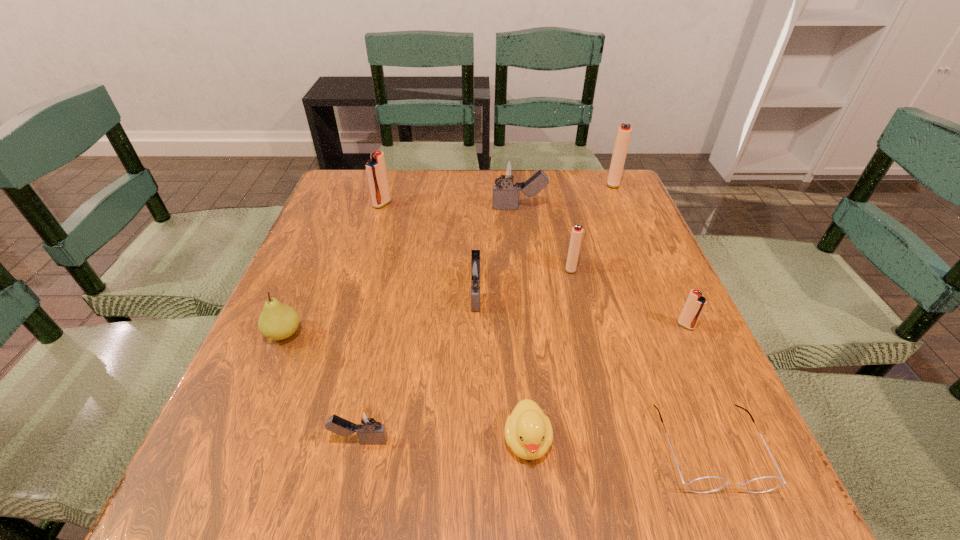
Point out which gray igniter is positioned as the second nearest to the third object from left to right. Please provide its 2D coordinates. Your answer should be formatted as a tuple, i.e. [(x, y)], where the tuple contains the x and y coordinates of a point satisfying the conditions above.

[(506, 171)]

Identify the location of free location that satisfies the following two spatial constraints: 1. on the back side of the fourth farthest igniter; 2. on the right side of the fifth igniter from right to left. (476, 268).

Identify the location of vacant region that satisfies the following two spatial constraints: 1. on the back side of the biggest red igniter; 2. on the right side of the rightmost gray igniter. (516, 183).